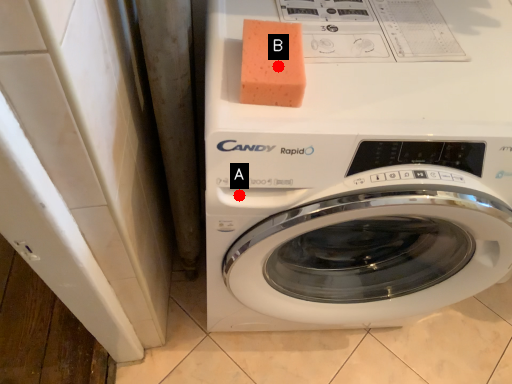
Question: Two points are circled on the image, labeled by A and B beside each circle. Among these points, which one is nearest to the camera?

Choices:
 (A) A is closer
 (B) B is closer

Answer: (B)